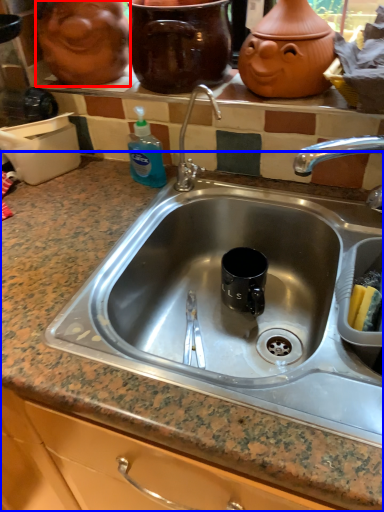
Question: Which object is further to the camera taking this photo, face (highlighted by a red box) or countertop (highlighted by a blue box)?

Choices:
 (A) face
 (B) countertop

Answer: (A)